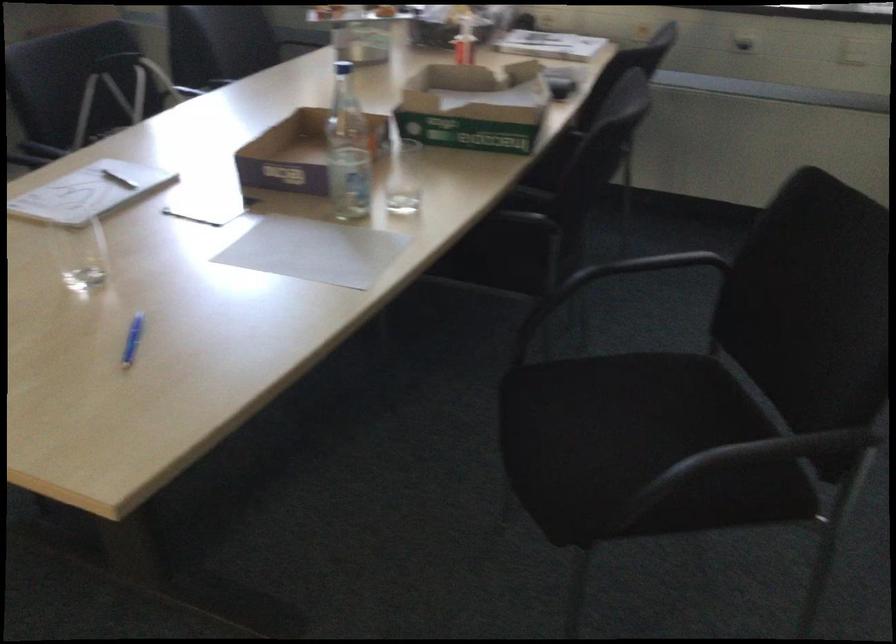
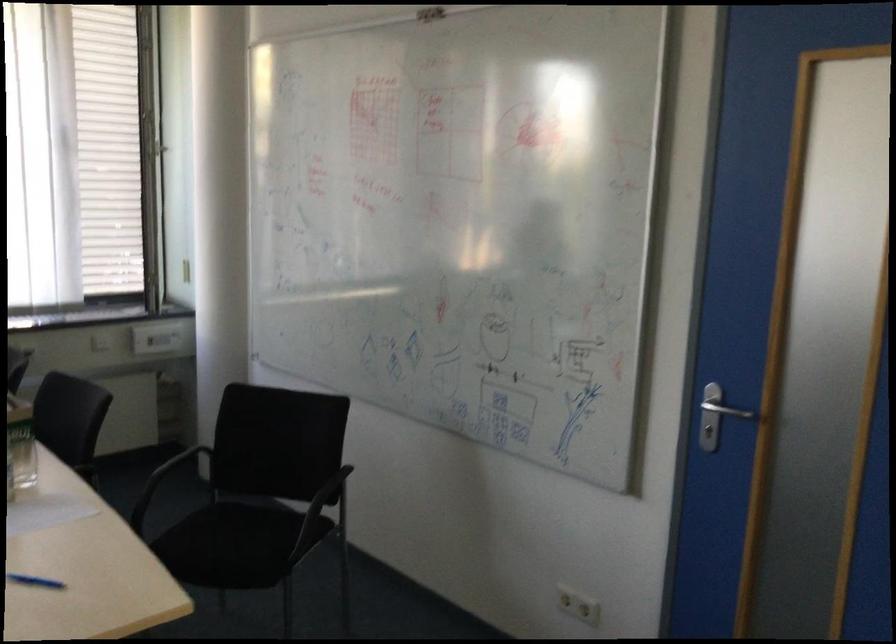
Find the pixel in the second image that matches point (151, 348) in the first image.

(35, 581)